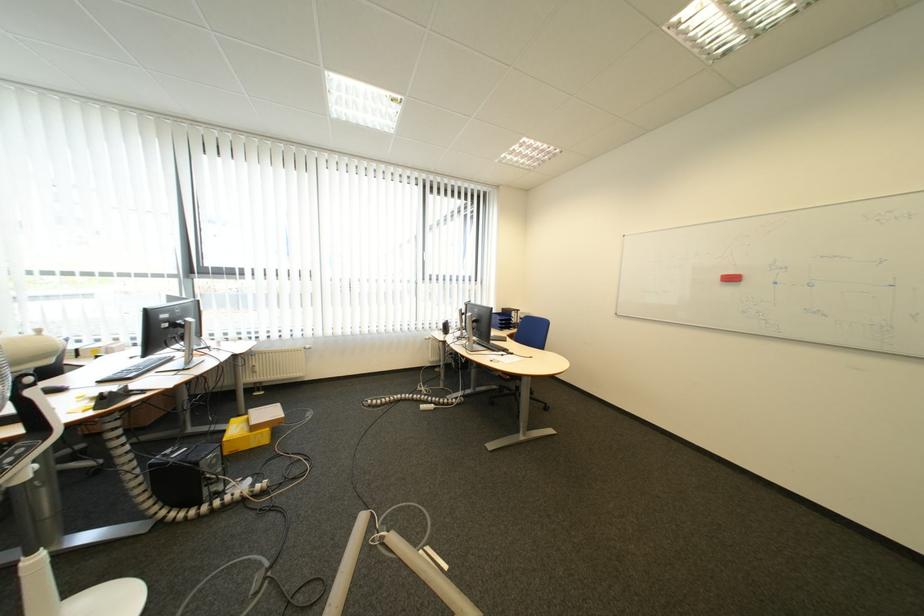
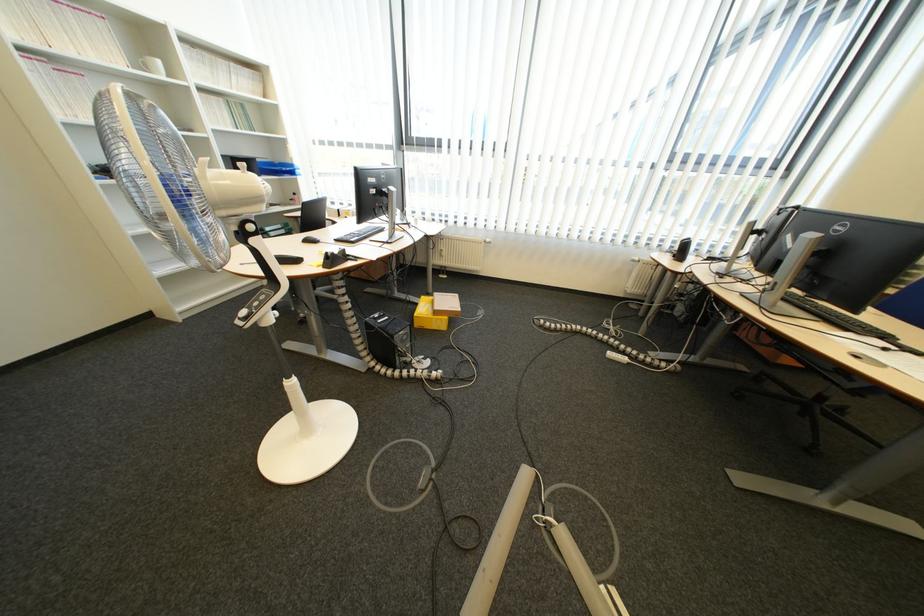
The point at (455,402) is marked in the first image. Where is the corresponding point in the second image?

(654, 358)